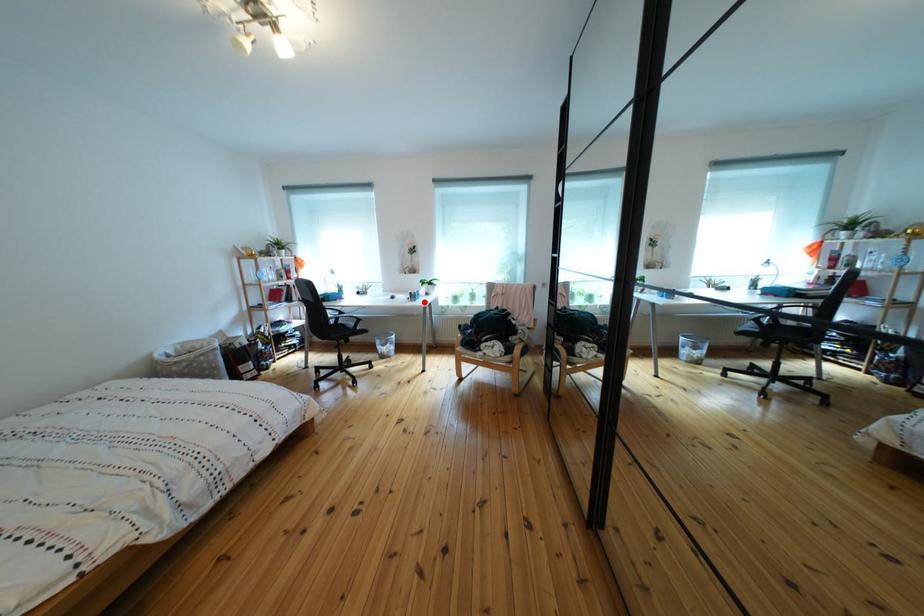
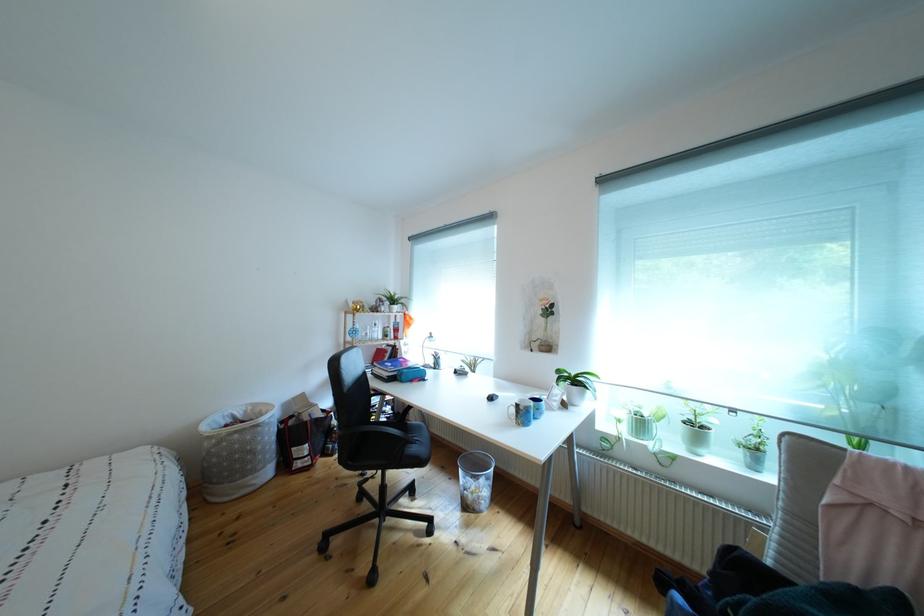
Question: A red point is marked in image1. In image2, is the corresponding 3D point closer to the camera or farther? Reply with the corresponding letter.

Choices:
 (A) The corresponding 3D point is closer.
 (B) The corresponding 3D point is farther.

Answer: (B)